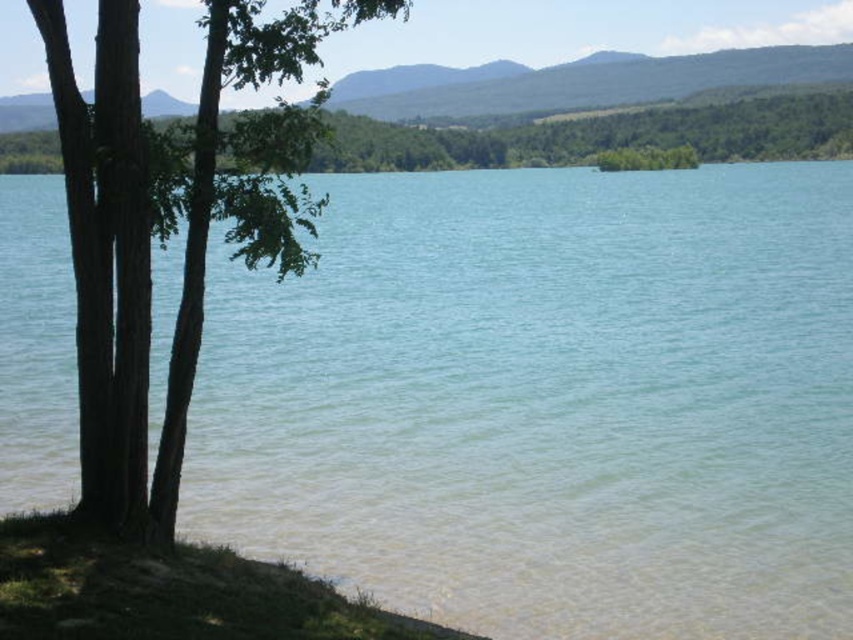
Question: Among these objects, which one is nearest to the camera?

Choices:
 (A) brown rough bark tree at left
 (B) green leafy tree at upper left
 (C) clear water at center

Answer: (A)

Question: Among these points, which one is nearest to the camera?

Choices:
 (A) (173, 177)
 (B) (587, 417)
 (C) (88, 550)

Answer: (C)

Question: Observing the image, what is the correct spatial positioning of clear water at center in reference to green leafy tree at upper left?

Choices:
 (A) left
 (B) right

Answer: (A)

Question: Does brown rough bark tree at left have a larger size compared to green leafy tree at upper left?

Choices:
 (A) yes
 (B) no

Answer: (B)

Question: Does brown rough bark tree at left have a larger size compared to green leafy tree at upper left?

Choices:
 (A) no
 (B) yes

Answer: (A)

Question: Which point is closer to the camera taking this photo?

Choices:
 (A) (265, 412)
 (B) (251, 568)
 (C) (103, 204)
 (D) (57, 170)

Answer: (C)